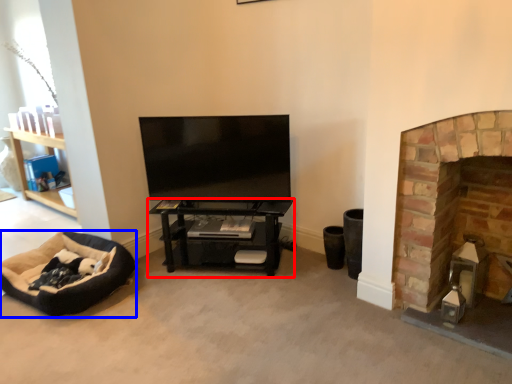
Question: Which object is closer to the camera taking this photo, shelf (highlighted by a red box) or dog bed (highlighted by a blue box)?

Choices:
 (A) shelf
 (B) dog bed

Answer: (B)